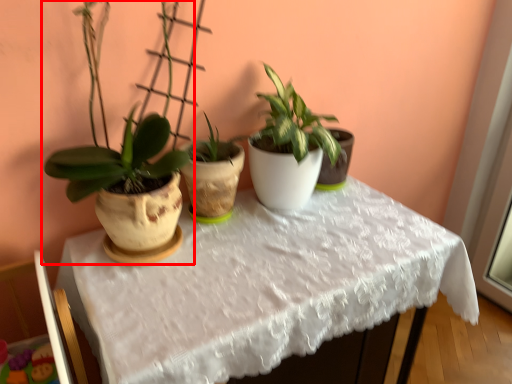
Question: From the image's perspective, considering the relative positions of houseplant (annotated by the red box) and table in the image provided, where is houseplant (annotated by the red box) located with respect to the staircase?

Choices:
 (A) above
 (B) below

Answer: (A)